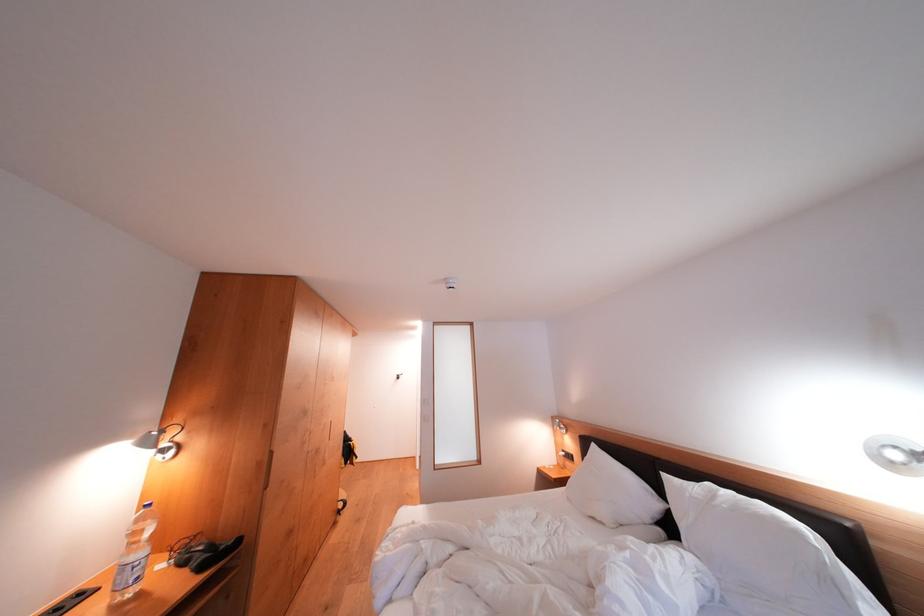
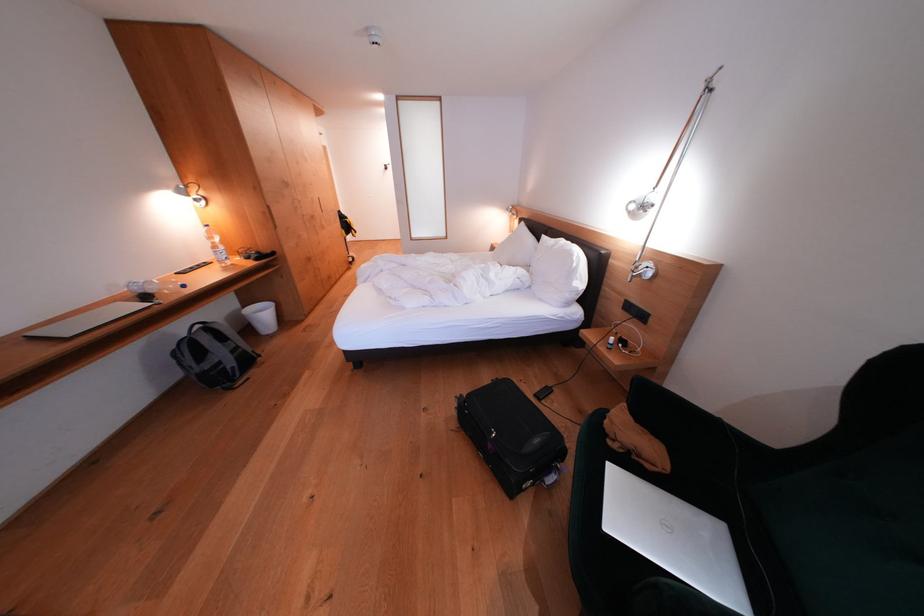
Question: The first image is from the beginning of the video and the second image is from the end. How did the camera likely rotate when shooting the video?

Choices:
 (A) Left
 (B) Right
 (C) Up
 (D) Down

Answer: (D)